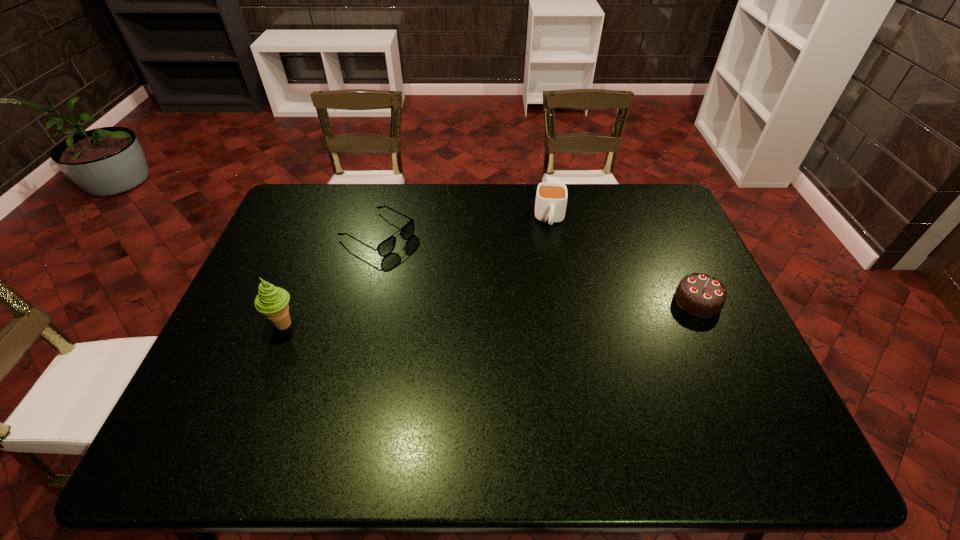
Find the location of a particular element. vacant area that lies between the rightmost object and the third object from left to right is located at coordinates (624, 260).

Where is `free space between the third object from left to right and the third object from right to left`? Image resolution: width=960 pixels, height=540 pixels. free space between the third object from left to right and the third object from right to left is located at coordinates (464, 227).

Where is `free spot between the spectacles and the leftmost object`? This screenshot has height=540, width=960. free spot between the spectacles and the leftmost object is located at coordinates (331, 279).

This screenshot has width=960, height=540. I want to click on the third closest object to the leftmost object, so click(701, 295).

You are a GUI agent. You are given a task and a screenshot of the screen. Output one action in this format:
    pyautogui.click(x=<x>, y=<y>)
    Task: Click on the object that is the second nearest to the cup
    
    Given the screenshot: What is the action you would take?
    386,247

This screenshot has width=960, height=540. I want to click on vacant region that satisfies the following two spatial constraints: 1. on the back side of the second object from left to right; 2. on the right side of the tallest object, so click(319, 234).

Where is `free space that satisfies the following two spatial constraints: 1. on the front side of the cup; 2. on the left side of the chocolate cake`? This screenshot has width=960, height=540. free space that satisfies the following two spatial constraints: 1. on the front side of the cup; 2. on the left side of the chocolate cake is located at coordinates (564, 301).

At what (x,y) coordinates should I click in order to perform the action: click on free spot that satisfies the following two spatial constraints: 1. on the back side of the chocolate cake; 2. on the left side of the tallest object. Please return your answer as a coordinate pair (x, y). This screenshot has width=960, height=540. Looking at the image, I should click on (293, 301).